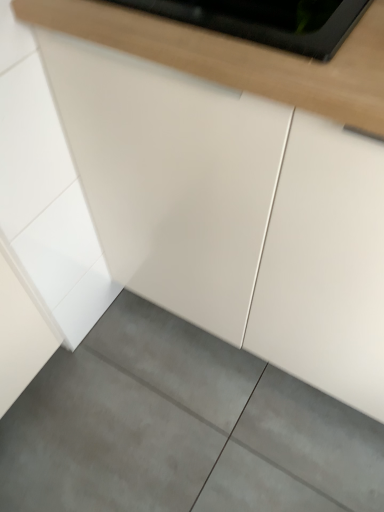
Locate an element on the screen. This screenshot has width=384, height=512. blank space above gray concrete floor at lower center (from a real-world perspective) is located at coordinates (172, 429).